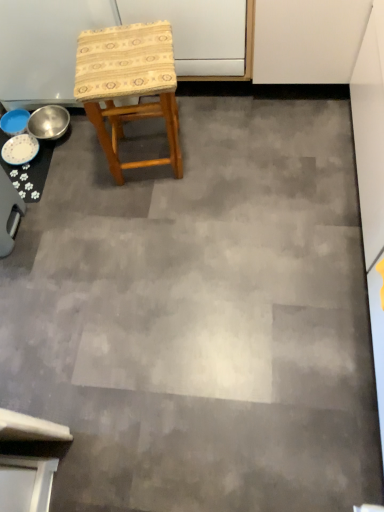
Identify the location of vacant space in front of metallic silver bowl at left. This screenshot has width=384, height=512. (73, 165).